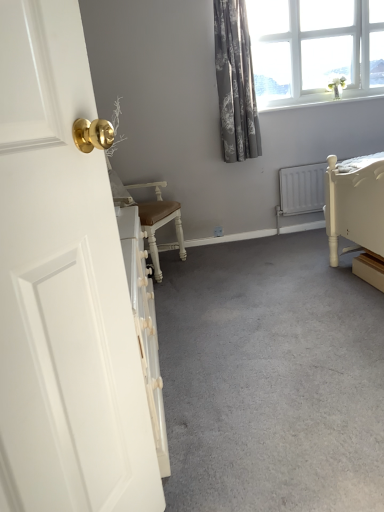
Question: From a real-world perspective, is white glass window at upper right physically below gray floral fabric curtain at upper right?

Choices:
 (A) yes
 (B) no

Answer: (B)

Question: Is white glass window at upper right closer to camera compared to gray floral fabric curtain at upper right?

Choices:
 (A) yes
 (B) no

Answer: (B)

Question: Is the surface of white glass window at upper right in direct contact with gray floral fabric curtain at upper right?

Choices:
 (A) no
 (B) yes

Answer: (A)

Question: Are white glass window at upper right and gray floral fabric curtain at upper right far apart?

Choices:
 (A) no
 (B) yes

Answer: (A)

Question: Could you tell me if white glass window at upper right is turned towards gray floral fabric curtain at upper right?

Choices:
 (A) no
 (B) yes

Answer: (A)

Question: Considering the relative sizes of white glass window at upper right and gray floral fabric curtain at upper right in the image provided, is white glass window at upper right shorter than gray floral fabric curtain at upper right?

Choices:
 (A) no
 (B) yes

Answer: (B)

Question: Can you confirm if white glossy door at left is thinner than gray carpet at center?

Choices:
 (A) no
 (B) yes

Answer: (B)

Question: Is white glossy door at left facing away from gray carpet at center?

Choices:
 (A) yes
 (B) no

Answer: (B)

Question: Could you tell me if white glossy door at left is facing gray carpet at center?

Choices:
 (A) yes
 (B) no

Answer: (B)

Question: Does white glossy door at left have a smaller size compared to gray carpet at center?

Choices:
 (A) yes
 (B) no

Answer: (A)

Question: From a real-world perspective, does white glossy door at left sit lower than gray carpet at center?

Choices:
 (A) no
 (B) yes

Answer: (A)

Question: Are white glossy door at left and gray carpet at center located far from each other?

Choices:
 (A) no
 (B) yes

Answer: (A)

Question: Is white glass window at upper right outside gray carpet at center?

Choices:
 (A) no
 (B) yes

Answer: (B)